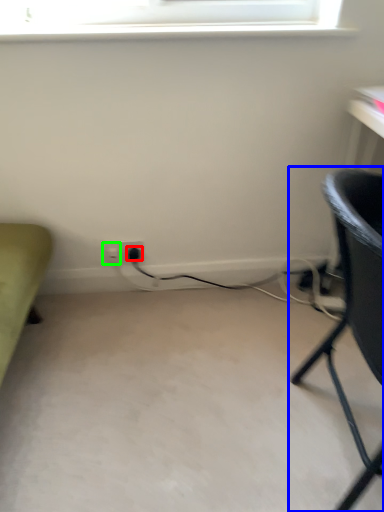
Question: Which object is the farthest from plug (highlighted by a red box)? Choose among these: chair (highlighted by a blue box) or electric outlet (highlighted by a green box).

Choices:
 (A) chair
 (B) electric outlet

Answer: (A)